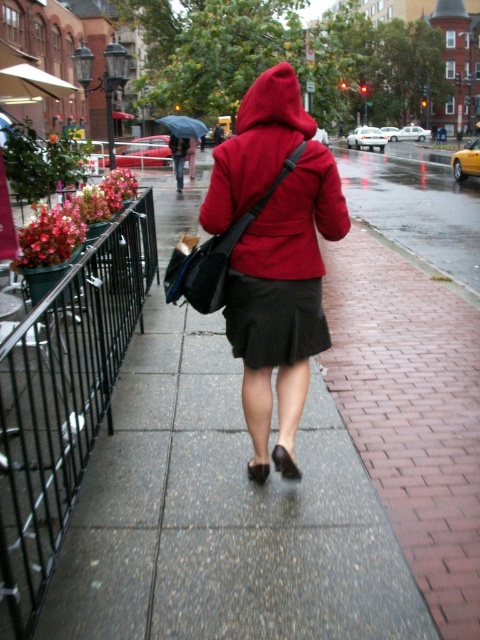
Which is behind, point (304, 273) or point (179, 122)?

The point (179, 122) is more distant.

Does matte red hoodie at center have a larger size compared to blue glossy umbrella at center?

No.

Which is in front, point (222, 205) or point (168, 115)?

Point (222, 205) is in front.

Image resolution: width=480 pixels, height=640 pixels. I want to click on matte red hoodie at center, so click(x=275, y=256).

Which is more to the left, concrete sidewalk at center or matte red hoodie at center?

From the viewer's perspective, concrete sidewalk at center appears more on the left side.

Which of these two, concrete sidewalk at center or matte red hoodie at center, stands shorter?

concrete sidewalk at center is shorter.

Is point (176, 483) farther from viewer compared to point (247, 371)?

Yes.

Where is `concrete sidewalk at center`? The width and height of the screenshot is (480, 640). concrete sidewalk at center is located at coordinates (222, 515).

Does black metal fence at left appear on the right side of matte red hoodie at center?

In fact, black metal fence at left is to the left of matte red hoodie at center.

Can you confirm if black metal fence at left is thinner than matte red hoodie at center?

No.

Is point (113, 310) positioned after point (240, 163)?

Yes, point (113, 310) is farther from viewer.

Find the location of a particular element. The image size is (480, 640). black metal fence at left is located at coordinates (63, 400).